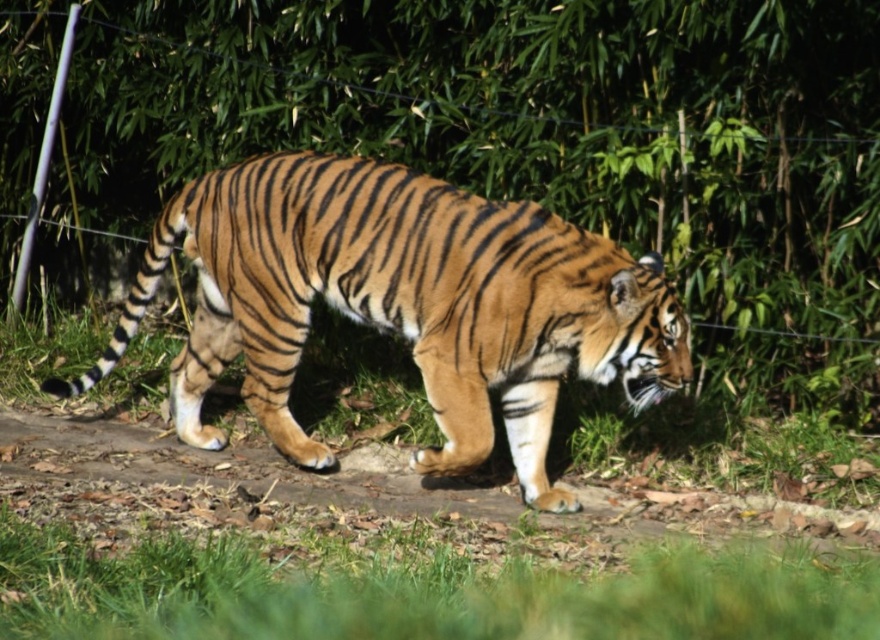
Based on the photo, you are a wildlife photographer carrying a camera bag that is 1.5 meters long. You need to set up your equipment between the wire mesh at center and the brown dirt path at center. Is there enough space to place your camera bag horizontally between them?

The wire mesh at center is 1.86 meters from the brown dirt path at center. Since your camera bag is 1.5 meters long, there is enough space to place it horizontally between them.